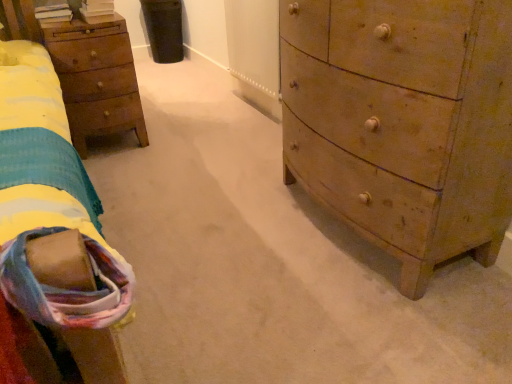
Question: Is wooden chest of drawers at right not within soft cotton blanket at lower left?

Choices:
 (A) no
 (B) yes

Answer: (B)

Question: From the image's perspective, is wooden chest of drawers at right beneath soft cotton blanket at lower left?

Choices:
 (A) yes
 (B) no

Answer: (B)

Question: Is wooden chest of drawers at right turned away from soft cotton blanket at lower left?

Choices:
 (A) yes
 (B) no

Answer: (B)

Question: Is the position of wooden chest of drawers at right more distant than that of soft cotton blanket at lower left?

Choices:
 (A) no
 (B) yes

Answer: (B)

Question: From a real-world perspective, is wooden chest of drawers at right on top of soft cotton blanket at lower left?

Choices:
 (A) yes
 (B) no

Answer: (B)

Question: Considering the relative sizes of wooden chest of drawers at right and soft cotton blanket at lower left in the image provided, is wooden chest of drawers at right shorter than soft cotton blanket at lower left?

Choices:
 (A) no
 (B) yes

Answer: (A)

Question: From the image's perspective, is wooden nightstand at left below soft cotton blanket at lower left?

Choices:
 (A) no
 (B) yes

Answer: (A)

Question: Is wooden nightstand at left facing towards soft cotton blanket at lower left?

Choices:
 (A) yes
 (B) no

Answer: (A)

Question: Considering the relative positions of wooden nightstand at left and soft cotton blanket at lower left in the image provided, is wooden nightstand at left to the left of soft cotton blanket at lower left from the viewer's perspective?

Choices:
 (A) yes
 (B) no

Answer: (A)

Question: From a real-world perspective, is wooden nightstand at left on soft cotton blanket at lower left?

Choices:
 (A) yes
 (B) no

Answer: (B)

Question: From the image's perspective, does wooden nightstand at left appear higher than soft cotton blanket at lower left?

Choices:
 (A) no
 (B) yes

Answer: (B)

Question: Can we say wooden nightstand at left lies outside soft cotton blanket at lower left?

Choices:
 (A) yes
 (B) no

Answer: (A)

Question: Can you confirm if wooden chest of drawers at right is thinner than wooden nightstand at left?

Choices:
 (A) yes
 (B) no

Answer: (B)